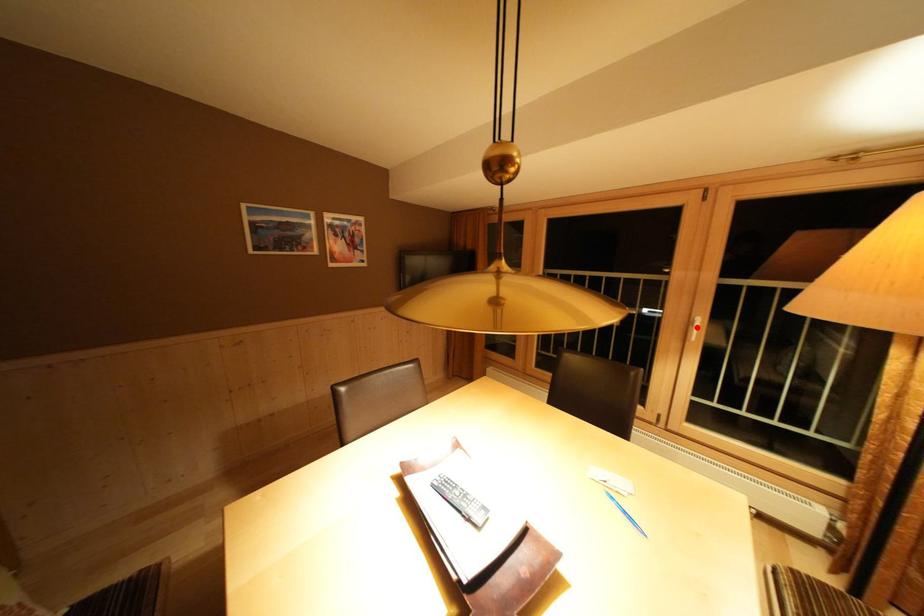
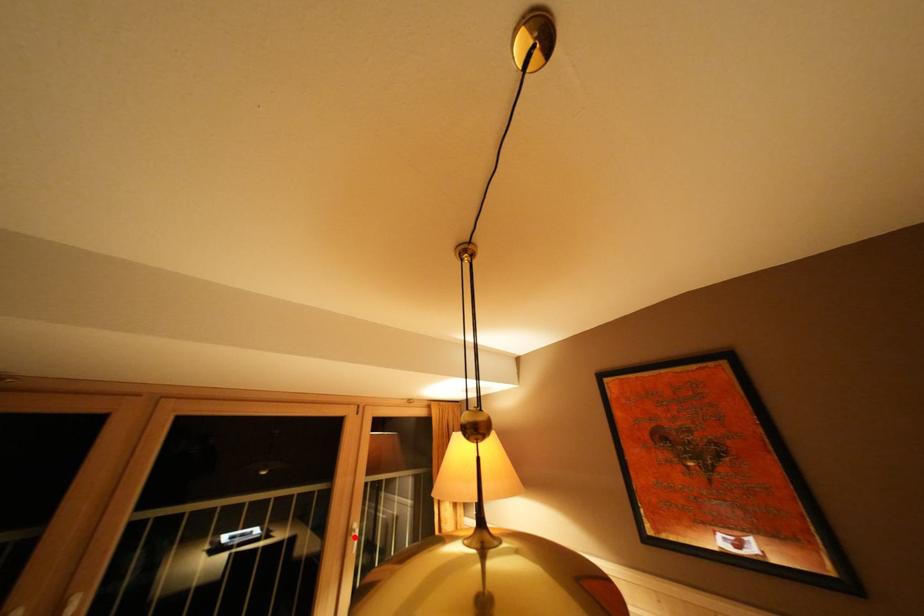
I am providing you with two images of the same scene from different viewpoints. A red point is marked on the first image and another point is marked on the second image. Are the points marked in image1 and image2 representing the same 3D position?

Yes